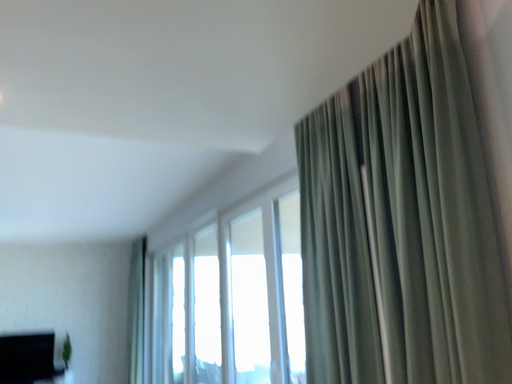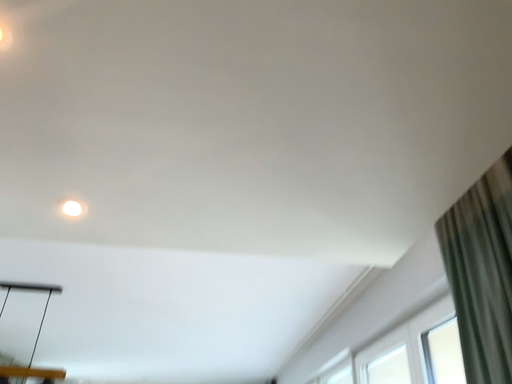
Question: Which way did the camera rotate in the video?

Choices:
 (A) rotated upward
 (B) rotated downward

Answer: (A)